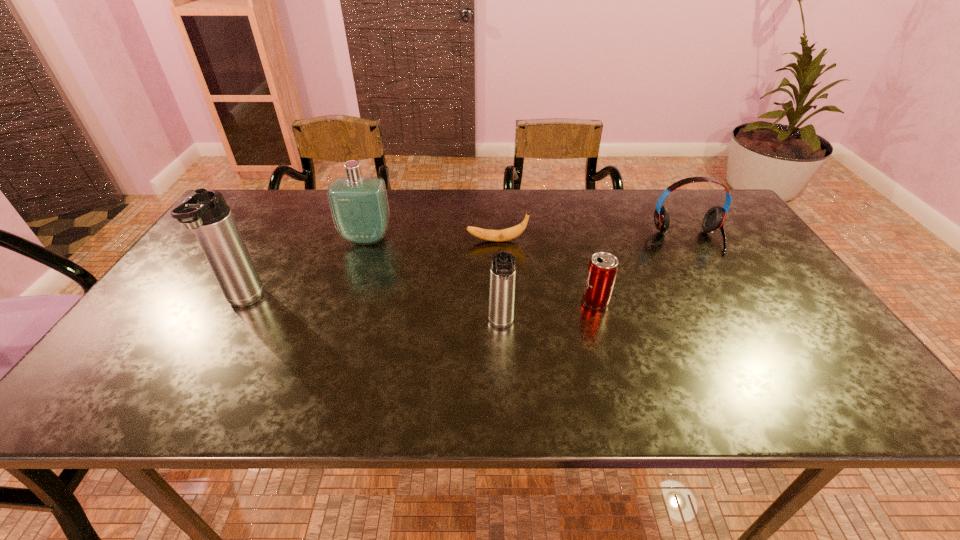
The image size is (960, 540). Identify the location of the left thermos bottle. (206, 212).

Where is `the taller thermos bottle`? This screenshot has height=540, width=960. the taller thermos bottle is located at coordinates (206, 212).

At what (x,y) coordinates should I click in order to perform the action: click on the shorter thermos bottle. Please return your answer as a coordinate pair (x, y). Image resolution: width=960 pixels, height=540 pixels. Looking at the image, I should click on (503, 264).

Where is `the rightmost object`? This screenshot has width=960, height=540. the rightmost object is located at coordinates (714, 219).

Identify the location of the shortest object. (507, 234).

Locate an element on the screen. This screenshot has height=540, width=960. the fifth object from left to right is located at coordinates (602, 270).

You are a GUI agent. You are given a task and a screenshot of the screen. Output one action in this format:
    pyautogui.click(x=<x>, y=<y>)
    Task: Click on the second shortest object
    The image size is (960, 540).
    Given the screenshot: What is the action you would take?
    pyautogui.click(x=602, y=270)

At what (x,y) coordinates should I click in order to perform the action: click on the second tallest object. Please return your answer as a coordinate pair (x, y). Image resolution: width=960 pixels, height=540 pixels. Looking at the image, I should click on (359, 206).

You are a GUI agent. You are given a task and a screenshot of the screen. Output one action in this format:
    pyautogui.click(x=<x>, y=<y>)
    Task: Click on the perfume
    The image size is (960, 540).
    Given the screenshot: What is the action you would take?
    pyautogui.click(x=359, y=206)

You are a GUI agent. You are given a task and a screenshot of the screen. Output one action in this format:
    pyautogui.click(x=<x>, y=<y>)
    Task: Click on the vacant region located on the handle side of the leftmost object
    
    Given the screenshot: What is the action you would take?
    pyautogui.click(x=206, y=367)